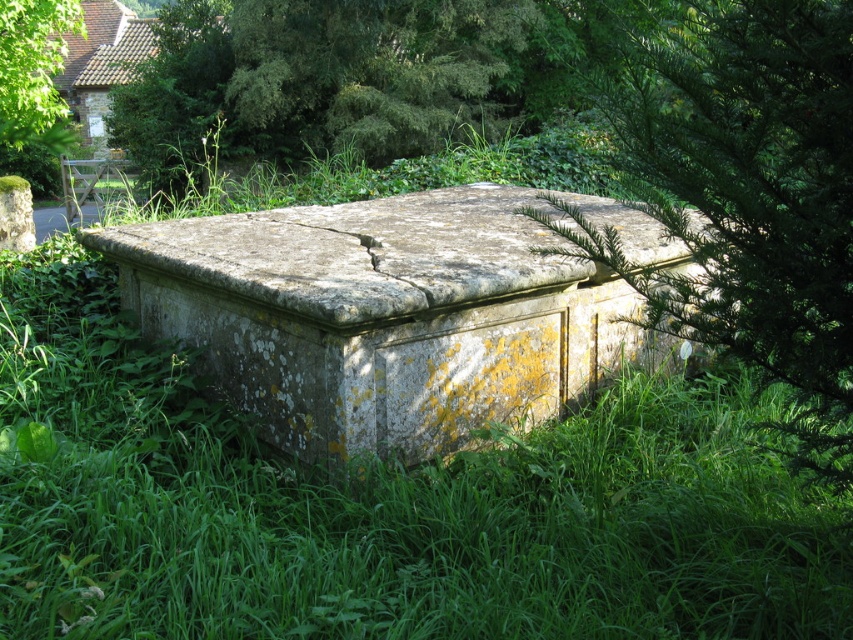
Question: Which point is closer to the camera?

Choices:
 (A) green leafy tree at upper center
 (B) green leafy tree at upper left
 (C) green leafy tree at center
 (D) speckled stone sarcophagus at center

Answer: (C)

Question: Does green leafy tree at upper center have a smaller size compared to green leafy tree at upper left?

Choices:
 (A) yes
 (B) no

Answer: (A)

Question: Which object appears closest to the camera in this image?

Choices:
 (A) speckled stone sarcophagus at center
 (B) green leafy tree at upper left

Answer: (A)

Question: Is speckled stone sarcophagus at center wider than green leafy tree at center?

Choices:
 (A) no
 (B) yes

Answer: (B)

Question: Based on their relative distances, which object is farther from the green leafy tree at center?

Choices:
 (A) speckled stone sarcophagus at center
 (B) green leafy tree at upper center

Answer: (B)

Question: Does green leafy tree at center appear on the left side of green leafy tree at upper left?

Choices:
 (A) yes
 (B) no

Answer: (B)